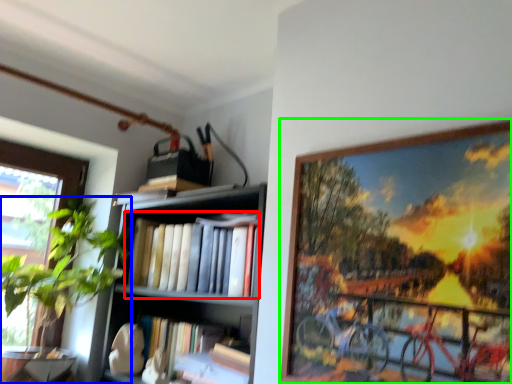
Question: Which object is the farthest from book (highlighted by a red box)? Choose among these: houseplant (highlighted by a blue box) or picture frame (highlighted by a green box).

Choices:
 (A) houseplant
 (B) picture frame

Answer: (B)